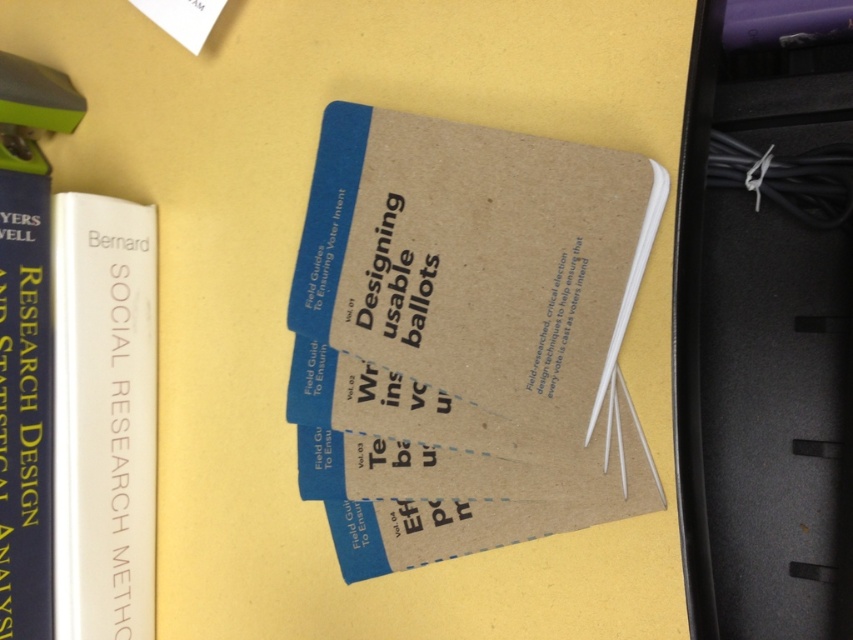
Looking at this image, what is the color of the book represented by the point at coordinates (103, 417)?

The white matte book at left is represented by point (103, 417), so the color is white.

You have a small object that is 1.5 inches long. You want to place it between the white matte book at left and the matte blue book at left on the desk. Will it fit in the space between them?

The white matte book at left and the matte blue book at left are 1.54 inches apart from each other. Since the object is 1.5 inches long, it will fit between them as the space is slightly larger than the object.

You are organizing books on a shelf and have to place the white matte book at left and the matte blue book at left. If you want to place the taller book on the bottom shelf to save space, which book should go there?

The matte blue book at left is taller than the white matte book at left, so place the matte blue book at left on the bottom shelf to save space.